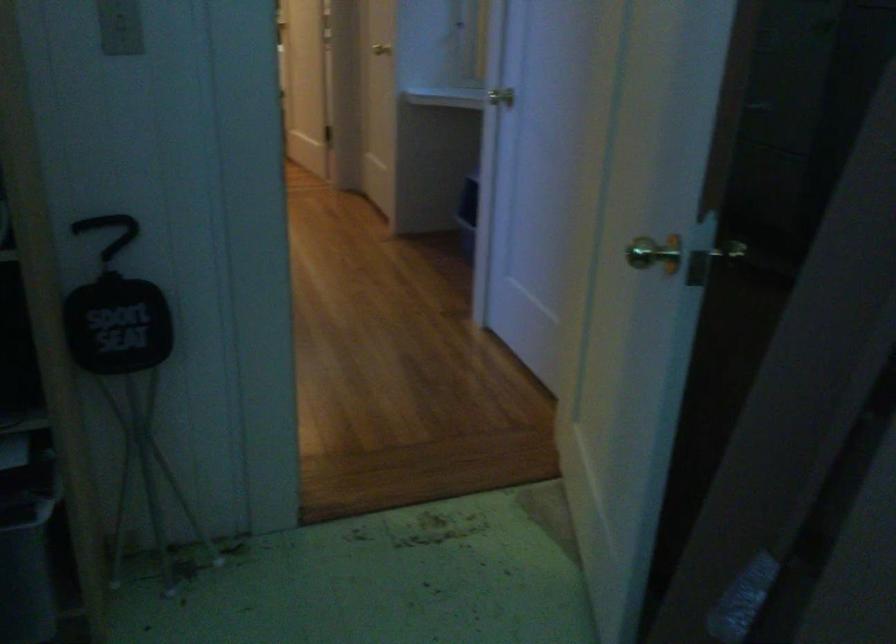
Find the location of `chair sitting surface`. chair sitting surface is located at coordinates (117, 325).